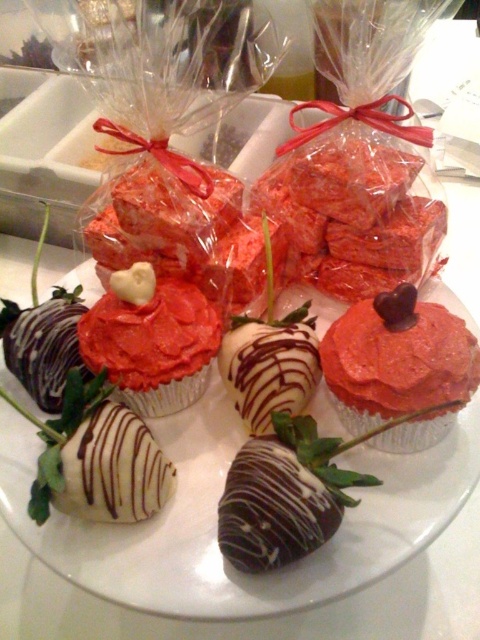
Question: Among these points, which one is nearest to the camera?

Choices:
 (A) (103, 346)
 (B) (420, 380)

Answer: (B)

Question: Among these objects, which one is farthest from the camera?

Choices:
 (A) red velvet cake at center
 (B) matte pink cupcake at center

Answer: (A)

Question: Can you confirm if matte pink cupcake at center is smaller than red velvet cake at center?

Choices:
 (A) no
 (B) yes

Answer: (A)

Question: Does matte pink cupcake at center appear on the left side of red velvet cake at center?

Choices:
 (A) no
 (B) yes

Answer: (A)

Question: Does matte pink cupcake at center come behind red velvet cake at center?

Choices:
 (A) yes
 (B) no

Answer: (B)

Question: Which point is farther from the camera taking this photo?

Choices:
 (A) (398, 403)
 (B) (148, 291)

Answer: (B)